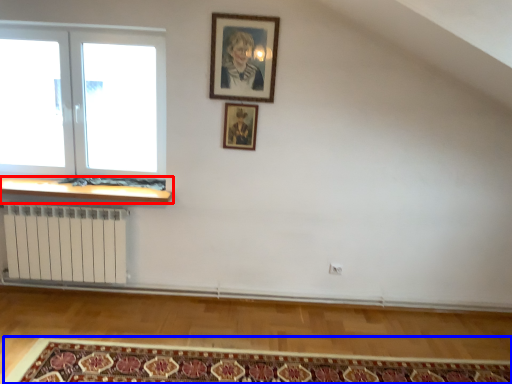
Question: Which point is closer to the camera, window sill (highlighted by a red box) or mat (highlighted by a blue box)?

Choices:
 (A) window sill
 (B) mat

Answer: (B)